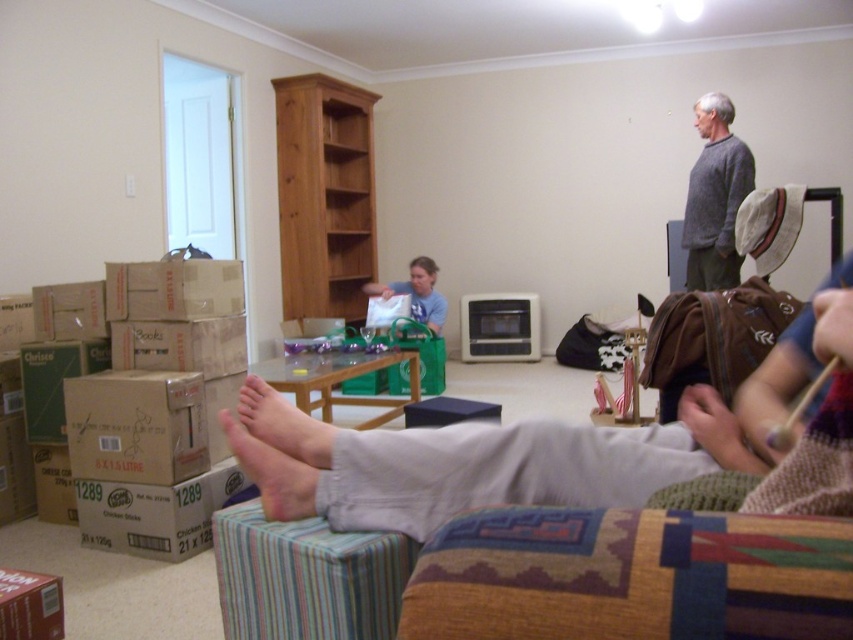
You are helping organize clothes in the living room. You have a drawer that can only hold items that take up less space than the matte gray shirt at center. Can the gray sweater at upper right fit in the drawer?

The gray sweater at upper right occupies less space than the matte gray shirt at center. Therefore, the gray sweater at upper right can fit in the drawer since it takes up less space than the required limit.

You are a photographer setting up a shoot in this living room. You notice the smooth skin foot at lower center and the light beige skin at lower center. From the photographer perspective, which object is positioned lower in the frame?

The smooth skin foot at lower center is located below light beige skin at lower center, so it is positioned lower in the frame.

You are helping to unpack boxes in the living room and see the gray sweater at upper right and the matte gray shirt at center. Which clothing item is positioned higher in the image?

The gray sweater at upper right is positioned higher than the matte gray shirt at center in the image.